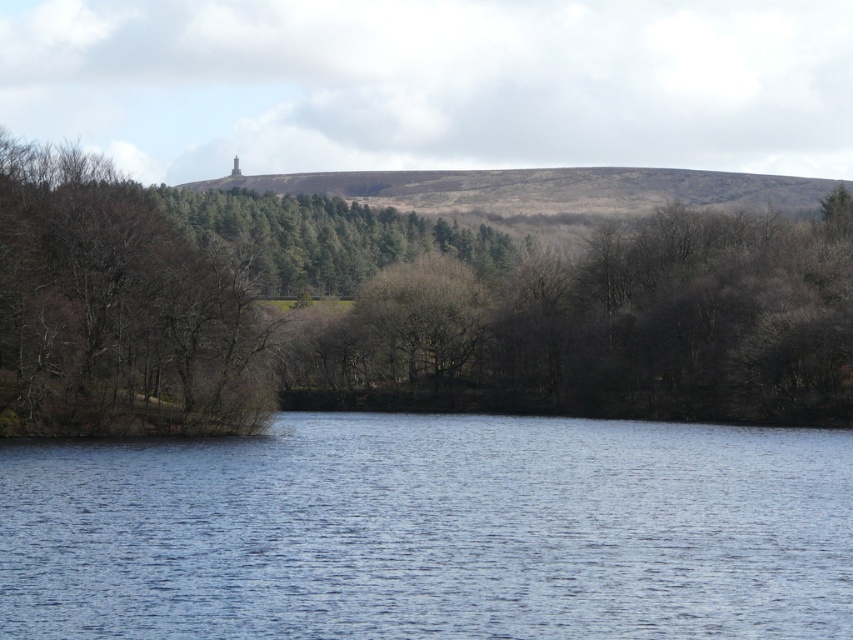
Question: Can you confirm if brown leafless tree at center is positioned above blue water at lower center?

Choices:
 (A) no
 (B) yes

Answer: (B)

Question: Considering the real-world distances, which object is closest to the brown leafless tree at center?

Choices:
 (A) blue water at lower center
 (B) brown/dry grassy hillside at center

Answer: (B)

Question: Which object is positioned closest to the brown/dry grassy hillside at center?

Choices:
 (A) brown leafless tree at center
 (B) blue water at lower center

Answer: (A)

Question: Which object is the farthest from the brown leafless tree at center?

Choices:
 (A) blue water at lower center
 (B) brown/dry grassy hillside at center

Answer: (A)

Question: Does brown leafless tree at center have a smaller size compared to blue water at lower center?

Choices:
 (A) yes
 (B) no

Answer: (B)

Question: Can you confirm if brown leafless tree at center is positioned to the right of brown/dry grassy hillside at center?

Choices:
 (A) yes
 (B) no

Answer: (B)